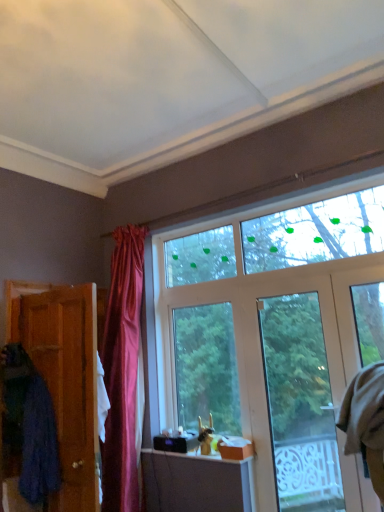
Question: Is blue fabric robe at left, positioned as the 2th robe in right-to-left order, aimed at clear glass door at center?

Choices:
 (A) yes
 (B) no

Answer: (B)

Question: Is blue fabric robe at left, positioned as the 2th robe in right-to-left order, thinner than clear glass door at center?

Choices:
 (A) yes
 (B) no

Answer: (B)

Question: Is blue fabric robe at left, the 1th robe when ordered from left to right, shorter than clear glass door at center?

Choices:
 (A) yes
 (B) no

Answer: (A)

Question: Is blue fabric robe at left, the 1th robe when ordered from left to right, surrounding clear glass door at center?

Choices:
 (A) no
 (B) yes

Answer: (A)

Question: Does blue fabric robe at left, positioned as the 2th robe in right-to-left order, have a smaller size compared to clear glass door at center?

Choices:
 (A) yes
 (B) no

Answer: (B)

Question: Looking at the image, does wooden door at left seem bigger or smaller compared to blue fabric robe at left, the 1th robe when ordered from left to right?

Choices:
 (A) small
 (B) big

Answer: (A)

Question: Is wooden door at left inside the boundaries of blue fabric robe at left, the 1th robe when ordered from left to right, or outside?

Choices:
 (A) inside
 (B) outside

Answer: (B)

Question: From a real-world perspective, is wooden door at left above or below blue fabric robe at left, positioned as the 2th robe in right-to-left order?

Choices:
 (A) above
 (B) below

Answer: (A)

Question: From the image's perspective, is wooden door at left above or below blue fabric robe at left, the 1th robe when ordered from left to right?

Choices:
 (A) below
 (B) above

Answer: (B)

Question: Is point (79, 400) positioned closer to the camera than point (281, 373)?

Choices:
 (A) closer
 (B) farther

Answer: (A)

Question: Relative to clear glass door at center, is wooden door at left in front or behind?

Choices:
 (A) front
 (B) behind

Answer: (A)

Question: From a real-world perspective, is wooden door at left positioned above or below clear glass door at center?

Choices:
 (A) below
 (B) above

Answer: (B)

Question: Considering the positions of wooden door at left and clear glass door at center in the image, is wooden door at left taller or shorter than clear glass door at center?

Choices:
 (A) tall
 (B) short

Answer: (B)

Question: From a real-world perspective, is blue fabric robe at left, positioned as the 2th robe in right-to-left order, above or below beige fabric robe at right, which is the 2th robe in left-to-right order?

Choices:
 (A) above
 (B) below

Answer: (B)

Question: Visually, is blue fabric robe at left, the 1th robe when ordered from left to right, positioned to the left or to the right of beige fabric robe at right, which is the 2th robe in left-to-right order?

Choices:
 (A) left
 (B) right

Answer: (A)